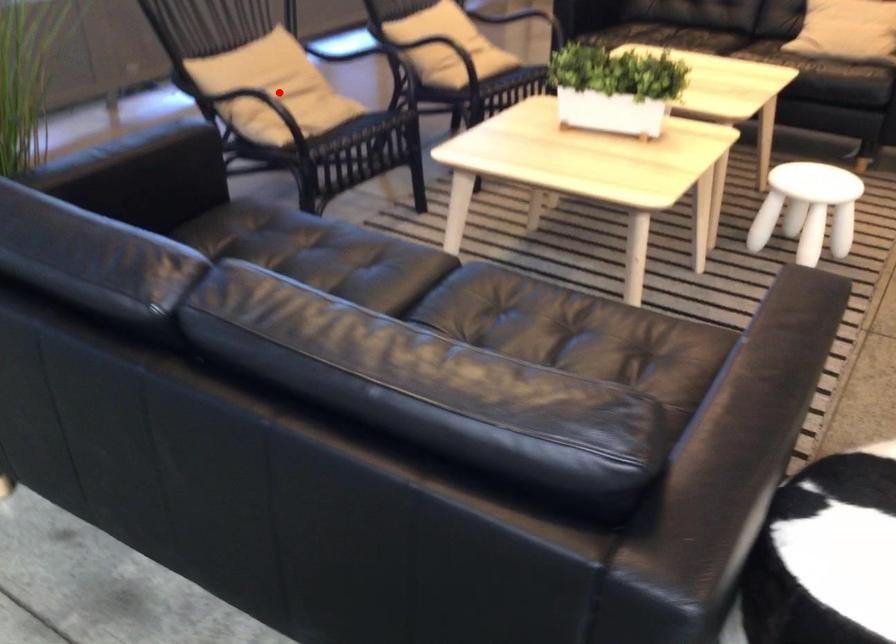
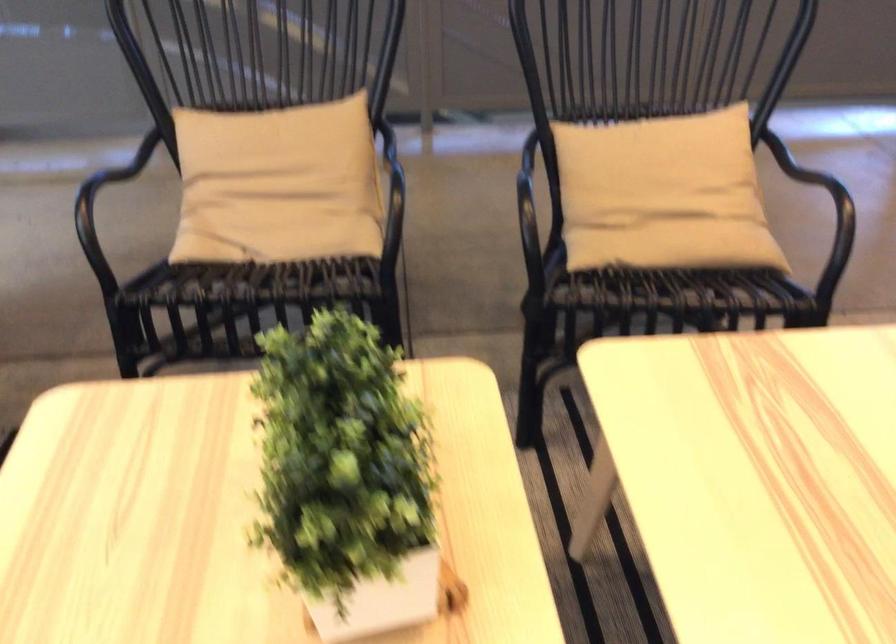
Question: I am providing you with two images of the same scene from different viewpoints. A red point is shown in image1. For the corresponding object point in image2, is it positioned nearer or farther from the camera?

Choices:
 (A) Nearer
 (B) Farther

Answer: (A)